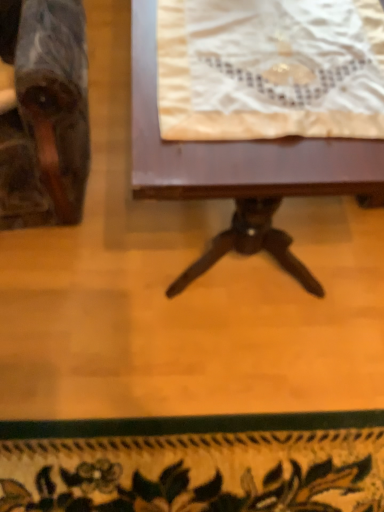
The image size is (384, 512). I want to click on vacant area that is in front of wooden table at center, so click(192, 375).